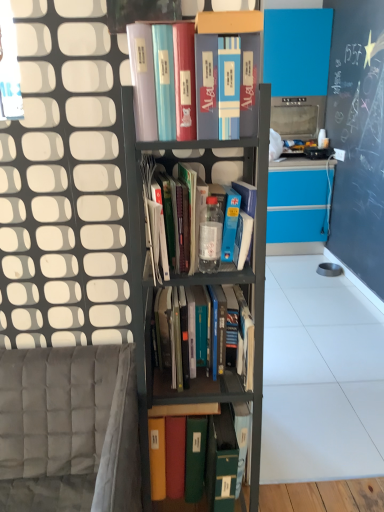
Question: Is hardcover books at center, which appears as the 2th book when ordered from the bottom, positioned beyond the bounds of green matte folder at center, the first book ordered from the bottom?

Choices:
 (A) no
 (B) yes

Answer: (B)

Question: Considering the relative sizes of hardcover books at center, which appears as the 2th book when ordered from the bottom, and green matte folder at center, which is the 4th book in top-to-bottom order, in the image provided, is hardcover books at center, which appears as the 2th book when ordered from the bottom, wider than green matte folder at center, which is the 4th book in top-to-bottom order,?

Choices:
 (A) no
 (B) yes

Answer: (A)

Question: Is hardcover books at center, which appears as the 2th book when ordered from the bottom, facing towards green matte folder at center, the first book ordered from the bottom?

Choices:
 (A) yes
 (B) no

Answer: (B)

Question: Is hardcover books at center, the 3th book in the top-to-bottom sequence, turned away from green matte folder at center, the first book ordered from the bottom?

Choices:
 (A) no
 (B) yes

Answer: (A)

Question: Does hardcover books at center, the 3th book in the top-to-bottom sequence, have a larger size compared to green matte folder at center, which is the 4th book in top-to-bottom order?

Choices:
 (A) yes
 (B) no

Answer: (B)

Question: Is the position of hardcover books at center, which appears as the 2th book when ordered from the bottom, more distant than that of green matte folder at center, the first book ordered from the bottom?

Choices:
 (A) no
 (B) yes

Answer: (A)

Question: From the image's perspective, is hardcover books at center, the 3th book in the top-to-bottom sequence, beneath gray fabric armchair at lower left?

Choices:
 (A) no
 (B) yes

Answer: (A)

Question: Is gray fabric armchair at lower left surrounded by hardcover books at center, which appears as the 2th book when ordered from the bottom?

Choices:
 (A) yes
 (B) no

Answer: (B)

Question: Is hardcover books at center, the 3th book in the top-to-bottom sequence, oriented towards gray fabric armchair at lower left?

Choices:
 (A) yes
 (B) no

Answer: (B)

Question: Is hardcover books at center, which appears as the 2th book when ordered from the bottom, at the left side of gray fabric armchair at lower left?

Choices:
 (A) yes
 (B) no

Answer: (B)

Question: Does hardcover books at center, which appears as the 2th book when ordered from the bottom, have a lesser height compared to gray fabric armchair at lower left?

Choices:
 (A) no
 (B) yes

Answer: (B)

Question: Is the depth of hardcover books at center, the 3th book in the top-to-bottom sequence, greater than that of gray fabric armchair at lower left?

Choices:
 (A) yes
 (B) no

Answer: (A)

Question: Is gray fabric armchair at lower left positioned beyond the bounds of translucent plastic bottle at center, positioned as the 3th book in bottom-to-top order?

Choices:
 (A) no
 (B) yes

Answer: (B)